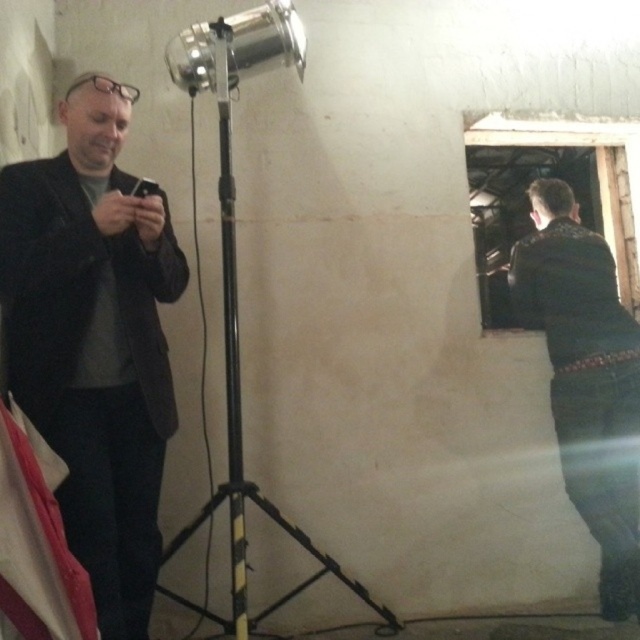
You are a fashion stylist preparing for a photoshoot. You need to place a mannequin between the black matte suit at left and the dark green leather jacket at right. The mannequin requires at least 1.5 meters of space to turn around comfortably. Based on the scene, will there be enough space?

The distance between the black matte suit at left and the dark green leather jacket at right is 1.61 meters. Since the mannequin needs at least 1.5 meters, there is sufficient space for it to move comfortably.

You are setting up a photo shoot and need to place a 30 cm wide prop between the black matte suit at left and the black matte tripod at center. Based on their widths, will the space between them accommodate the prop?

The black matte suit at left has a lesser width compared to the black matte tripod at center, so the space between them may be sufficient to place the 30 cm wide prop, but this depends on the actual distance between the two objects. The width comparison alone doesn

Based on the scene description, where is the black matte suit at left located in terms of its 2D coordinates?

The black matte suit at left is located at the 2D coordinates point (93, 340).